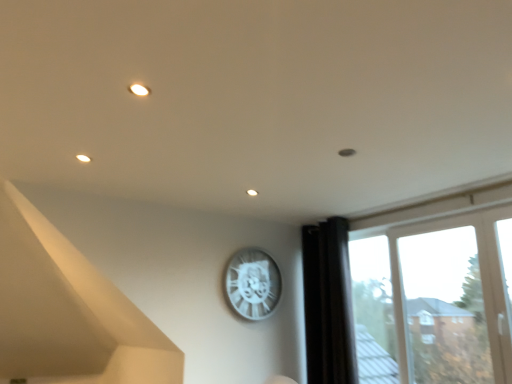
At what (x,y) coordinates should I click in order to perform the action: click on white metallic clock at upper center. Please return your answer as a coordinate pair (x, y). Image resolution: width=512 pixels, height=384 pixels. Looking at the image, I should click on (252, 284).

What do you see at coordinates (252, 284) in the screenshot? This screenshot has height=384, width=512. I see `white metallic clock at upper center` at bounding box center [252, 284].

Identify the location of black fabric curtain at right. The image size is (512, 384). click(x=328, y=303).

This screenshot has width=512, height=384. Find the location of `white metallic clock at upper center`. white metallic clock at upper center is located at coordinates (252, 284).

Considering the sizes of objects white metallic clock at upper center and black fabric curtain at right in the image provided, who is thinner, white metallic clock at upper center or black fabric curtain at right?

white metallic clock at upper center.

From a real-world perspective, which is physically above, white metallic clock at upper center or black fabric curtain at right?

white metallic clock at upper center.

Is white metallic clock at upper center inside the boundaries of black fabric curtain at right, or outside?

white metallic clock at upper center lies outside black fabric curtain at right.

Is white metallic clock at upper center facing away from black fabric curtain at right?

white metallic clock at upper center is not turned away from black fabric curtain at right.

I want to click on window below the black fabric curtain at right (from a real-world perspective), so click(435, 292).

Is transparent glass window at right turned away from black fabric curtain at right?

No, transparent glass window at right's orientation is not away from black fabric curtain at right.

Looking at their sizes, would you say transparent glass window at right is wider or thinner than black fabric curtain at right?

Considering their sizes, transparent glass window at right looks slimmer than black fabric curtain at right.

From the image's perspective, which one is positioned lower, transparent glass window at right or black fabric curtain at right?

black fabric curtain at right.

Is black fabric curtain at right closer to the viewer compared to transparent glass window at right?

No, the depth of black fabric curtain at right is greater than that of transparent glass window at right.

Can you confirm if black fabric curtain at right is shorter than transparent glass window at right?

Incorrect, the height of black fabric curtain at right does not fall short of that of transparent glass window at right.

Which point is more forward, (311, 344) or (483, 346)?

The point (483, 346) is more forward.

Is white metallic clock at upper center at the right side of transparent glass window at right?

Incorrect, white metallic clock at upper center is not on the right side of transparent glass window at right.

Identify the location of wall clock above the transparent glass window at right (from the image's perspective). (252, 284).

Is white metallic clock at upper center positioned far away from transparent glass window at right?

Absolutely, white metallic clock at upper center is distant from transparent glass window at right.

Considering the relative sizes of transparent glass window at right and white metallic clock at upper center in the image provided, is transparent glass window at right wider than white metallic clock at upper center?

Indeed, transparent glass window at right has a greater width compared to white metallic clock at upper center.

Are transparent glass window at right and white metallic clock at upper center far apart?

transparent glass window at right is positioned a significant distance from white metallic clock at upper center.

In the image, there is a white metallic clock at upper center. Where is `window below it (from the image's perspective)`? This screenshot has width=512, height=384. window below it (from the image's perspective) is located at coordinates (435, 292).

Which is more to the left, transparent glass window at right or white metallic clock at upper center?

Positioned to the left is white metallic clock at upper center.

Is black fabric curtain at right taller or shorter than white metallic clock at upper center?

In the image, black fabric curtain at right appears to be taller than white metallic clock at upper center.

Can you tell me how much black fabric curtain at right and white metallic clock at upper center differ in facing direction?

The angle between the facing direction of black fabric curtain at right and the facing direction of white metallic clock at upper center is 90.1 degrees.

Is black fabric curtain at right at the right side of white metallic clock at upper center?

Indeed, black fabric curtain at right is positioned on the right side of white metallic clock at upper center.

From a real-world perspective, is black fabric curtain at right under white metallic clock at upper center?

Yes, from a real-world perspective, black fabric curtain at right is under white metallic clock at upper center.

At what (x,y) coordinates should I click in order to perform the action: click on wall clock above the black fabric curtain at right (from a real-world perspective). Please return your answer as a coordinate pair (x, y). Looking at the image, I should click on pyautogui.click(x=252, y=284).

Identify the location of window on the right of the black fabric curtain at right. (435, 292).

Looking at the image, which one is located closer to transparent glass window at right, white metallic clock at upper center or black fabric curtain at right?

Based on the image, black fabric curtain at right appears to be nearer to transparent glass window at right.

Looking at the image, which one is located closer to white metallic clock at upper center, black fabric curtain at right or transparent glass window at right?

Based on the image, black fabric curtain at right appears to be nearer to white metallic clock at upper center.

Estimate the real-world distances between objects in this image. Which object is closer to black fabric curtain at right, white metallic clock at upper center or transparent glass window at right?

The object closer to black fabric curtain at right is transparent glass window at right.

Looking at the image, which one is located closer to black fabric curtain at right, transparent glass window at right or white metallic clock at upper center?

transparent glass window at right is closer to black fabric curtain at right.

Which object lies further to the anchor point transparent glass window at right, black fabric curtain at right or white metallic clock at upper center?

Based on the image, white metallic clock at upper center appears to be further to transparent glass window at right.

Based on their spatial positions, is transparent glass window at right or black fabric curtain at right further from white metallic clock at upper center?

transparent glass window at right is further to white metallic clock at upper center.

At what (x,y) coordinates should I click in order to perform the action: click on curtain situated between white metallic clock at upper center and transparent glass window at right from left to right. Please return your answer as a coordinate pair (x, y). Image resolution: width=512 pixels, height=384 pixels. Looking at the image, I should click on (328, 303).